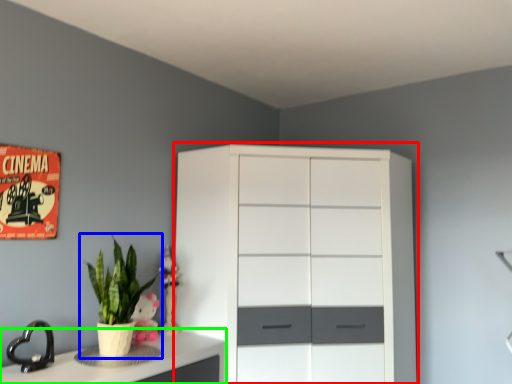
Question: Which is nearer to the chest of drawers (highlighted by a red box)? houseplant (highlighted by a blue box) or counter top (highlighted by a green box).

Choices:
 (A) houseplant
 (B) counter top

Answer: (B)